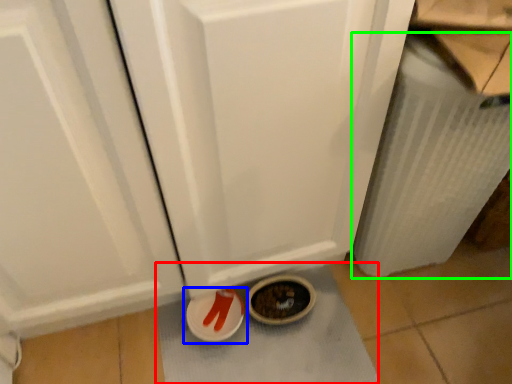
Question: Which object is positioned closest to bath mat (highlighted by a red box)? Select from footwear (highlighted by a blue box) and radiator (highlighted by a green box).

Choices:
 (A) footwear
 (B) radiator

Answer: (A)